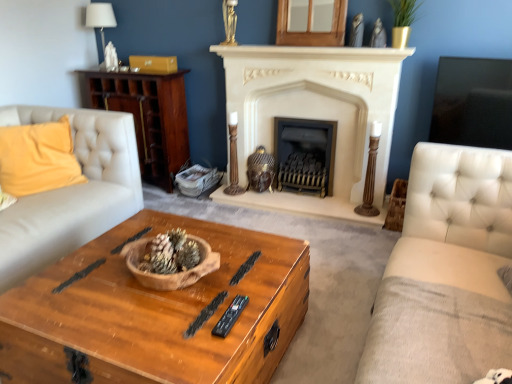
Where is `unoccupied space behind black plastic remote at center`? Image resolution: width=512 pixels, height=384 pixels. unoccupied space behind black plastic remote at center is located at coordinates (236, 282).